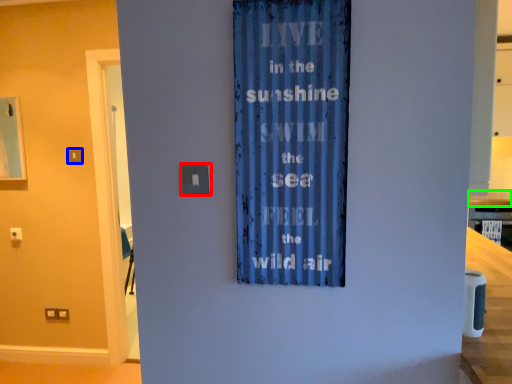
Question: Based on their relative distances, which object is nearer to light switch (highlighted by a red box)? Choose from light switch (highlighted by a blue box) and counter top (highlighted by a green box).

Choices:
 (A) light switch
 (B) counter top

Answer: (A)